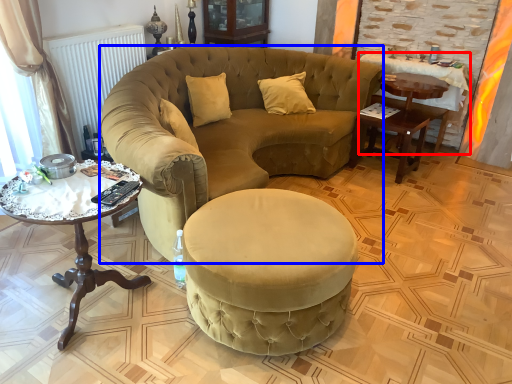
Question: Among these objects, which one is nearest to the camera, desk (highlighted by a red box) or chair (highlighted by a blue box)?

Choices:
 (A) desk
 (B) chair

Answer: (B)